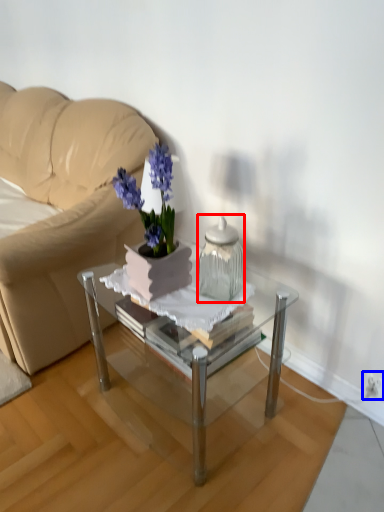
Question: Among these objects, which one is farthest to the camera, vase (highlighted by a red box) or electric outlet (highlighted by a blue box)?

Choices:
 (A) vase
 (B) electric outlet

Answer: (B)